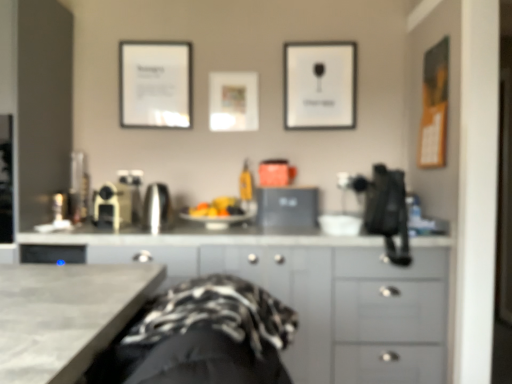
Question: Should I look upward or downward to see satin black laptop at center, which appears as the third appliance when viewed from the left?

Choices:
 (A) up
 (B) down

Answer: (B)

Question: Is gray matte cabinet at center positioned with its back to matte white picture frame at center, which is the 2th picture frame from left to right?

Choices:
 (A) no
 (B) yes

Answer: (A)

Question: From a real-world perspective, is gray matte cabinet at center on matte white picture frame at center, which is the 2th picture frame from left to right?

Choices:
 (A) yes
 (B) no

Answer: (B)

Question: Is gray matte cabinet at center next to matte white picture frame at center, marked as the 2th picture frame in a right-to-left arrangement?

Choices:
 (A) no
 (B) yes

Answer: (A)

Question: Is gray matte cabinet at center closer to the viewer compared to matte white picture frame at center, marked as the 2th picture frame in a right-to-left arrangement?

Choices:
 (A) yes
 (B) no

Answer: (A)

Question: From a real-world perspective, is gray matte cabinet at center positioned under matte white picture frame at center, marked as the 2th picture frame in a right-to-left arrangement, based on gravity?

Choices:
 (A) yes
 (B) no

Answer: (A)

Question: Can you confirm if gray matte cabinet at center is taller than matte white picture frame at center, which is the 2th picture frame from left to right?

Choices:
 (A) yes
 (B) no

Answer: (A)

Question: Is satin gold coffee maker at center, which ranks as the first appliance in left-to-right order, positioned in front of satin black laptop at center, the first appliance in the right-to-left sequence?

Choices:
 (A) no
 (B) yes

Answer: (B)

Question: Is satin gold coffee maker at center, which ranks as the first appliance in left-to-right order, to the right of satin black laptop at center, the first appliance in the right-to-left sequence, from the viewer's perspective?

Choices:
 (A) yes
 (B) no

Answer: (B)

Question: Does satin gold coffee maker at center, which is the third appliance from right to left, have a greater height compared to satin black laptop at center, the first appliance in the right-to-left sequence?

Choices:
 (A) no
 (B) yes

Answer: (B)

Question: Is satin gold coffee maker at center, which is the third appliance from right to left, positioned with its back to satin black laptop at center, the first appliance in the right-to-left sequence?

Choices:
 (A) no
 (B) yes

Answer: (A)

Question: Would you say satin gold coffee maker at center, which ranks as the first appliance in left-to-right order, contains satin black laptop at center, which appears as the third appliance when viewed from the left?

Choices:
 (A) no
 (B) yes

Answer: (A)

Question: From a real-world perspective, is satin gold coffee maker at center, which ranks as the first appliance in left-to-right order, over satin black laptop at center, which appears as the third appliance when viewed from the left?

Choices:
 (A) yes
 (B) no

Answer: (A)

Question: Does matte white picture frame at center, marked as the 2th picture frame in a right-to-left arrangement, have a greater height compared to gray matte cabinet at center?

Choices:
 (A) yes
 (B) no

Answer: (B)